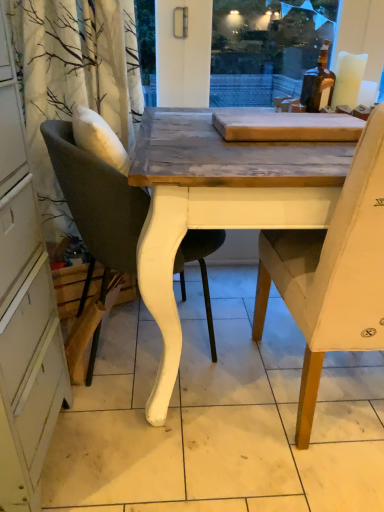
Question: Would you say light beige fabric chair at right, which appears as the 2th chair when viewed from the left, is outside matte gray cushioned chair at left, the first chair when ordered from left to right?

Choices:
 (A) no
 (B) yes

Answer: (B)

Question: Is light beige fabric chair at right, which appears as the 2th chair when viewed from the left, facing away from matte gray cushioned chair at left, the first chair when ordered from left to right?

Choices:
 (A) yes
 (B) no

Answer: (B)

Question: Is light beige fabric chair at right, which is the first chair from right to left, oriented towards matte gray cushioned chair at left, the first chair when ordered from left to right?

Choices:
 (A) yes
 (B) no

Answer: (B)

Question: From a real-world perspective, is light beige fabric chair at right, which is the first chair from right to left, located higher than matte gray cushioned chair at left, the second chair viewed from the right?

Choices:
 (A) no
 (B) yes

Answer: (B)

Question: From the image's perspective, is light beige fabric chair at right, which is the first chair from right to left, over matte gray cushioned chair at left, the first chair when ordered from left to right?

Choices:
 (A) no
 (B) yes

Answer: (A)

Question: Is light beige fabric chair at right, which is the first chair from right to left, behind matte gray cushioned chair at left, the second chair viewed from the right?

Choices:
 (A) no
 (B) yes

Answer: (A)

Question: Is matte gray cushioned chair at left, the second chair viewed from the right, facing towards light beige fabric chair at right, which is the first chair from right to left?

Choices:
 (A) yes
 (B) no

Answer: (A)

Question: Considering the relative positions of matte gray cushioned chair at left, the second chair viewed from the right, and light beige fabric chair at right, which appears as the 2th chair when viewed from the left, in the image provided, is matte gray cushioned chair at left, the second chair viewed from the right, in front of light beige fabric chair at right, which appears as the 2th chair when viewed from the left,?

Choices:
 (A) no
 (B) yes

Answer: (A)

Question: Does matte gray cushioned chair at left, the first chair when ordered from left to right, have a smaller size compared to light beige fabric chair at right, which appears as the 2th chair when viewed from the left?

Choices:
 (A) yes
 (B) no

Answer: (A)

Question: From a real-world perspective, does matte gray cushioned chair at left, the second chair viewed from the right, stand above light beige fabric chair at right, which is the first chair from right to left?

Choices:
 (A) no
 (B) yes

Answer: (A)

Question: Is light beige fabric chair at right, which is the first chair from right to left, a part of matte gray cushioned chair at left, the second chair viewed from the right?

Choices:
 (A) no
 (B) yes

Answer: (A)

Question: Can you see matte gray cushioned chair at left, the first chair when ordered from left to right, touching light beige fabric chair at right, which is the first chair from right to left?

Choices:
 (A) no
 (B) yes

Answer: (A)

Question: From a real-world perspective, is light beige fabric chair at right, which appears as the 2th chair when viewed from the left, above or below matte gray cushioned chair at left, the first chair when ordered from left to right?

Choices:
 (A) above
 (B) below

Answer: (A)